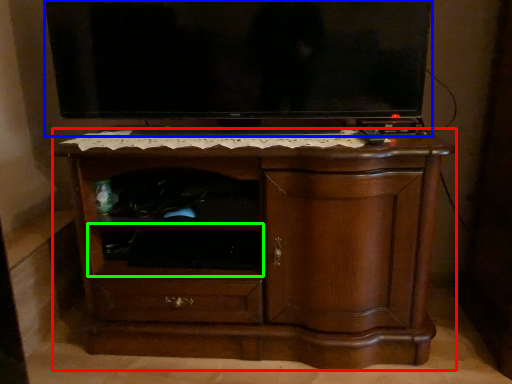
Question: Which is nearer to the chest of drawers (highlighted by a red box)? television (highlighted by a blue box) or shelf (highlighted by a green box).

Choices:
 (A) television
 (B) shelf

Answer: (B)